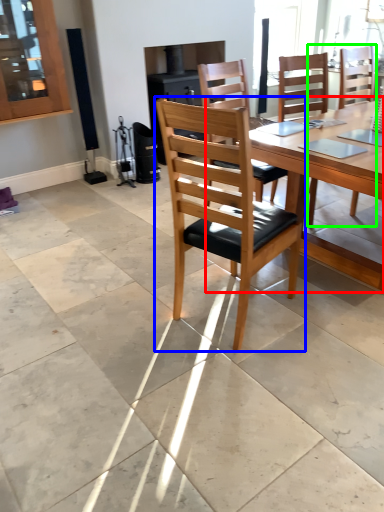
Question: Based on their relative distances, which object is farther from round table (highlighted by a red box)? Choose from chair (highlighted by a blue box) and chair (highlighted by a green box).

Choices:
 (A) chair
 (B) chair

Answer: (B)